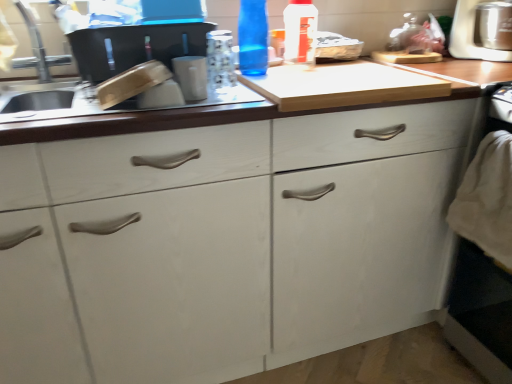
Question: Is blue glass bottle at upper center, arranged as the second bottle when viewed from the right, facing away from white matte cabinet at center?

Choices:
 (A) yes
 (B) no

Answer: (B)

Question: From the image's perspective, is blue glass bottle at upper center, the 1th bottle when ordered from left to right, under white matte cabinet at center?

Choices:
 (A) yes
 (B) no

Answer: (B)

Question: Is blue glass bottle at upper center, arranged as the second bottle when viewed from the right, to the left of white matte cabinet at center from the viewer's perspective?

Choices:
 (A) yes
 (B) no

Answer: (A)

Question: Is blue glass bottle at upper center, arranged as the second bottle when viewed from the right, completely or partially outside of white matte cabinet at center?

Choices:
 (A) no
 (B) yes

Answer: (B)

Question: From a real-world perspective, is blue glass bottle at upper center, the 1th bottle when ordered from left to right, beneath white matte cabinet at center?

Choices:
 (A) yes
 (B) no

Answer: (B)

Question: From the image's perspective, is blue glass bottle at upper center, arranged as the second bottle when viewed from the right, on white matte cabinet at center?

Choices:
 (A) yes
 (B) no

Answer: (A)

Question: Can you confirm if brushed metal faucet at upper left is taller than blue glass bottle at upper center, arranged as the second bottle when viewed from the right?

Choices:
 (A) yes
 (B) no

Answer: (B)

Question: From the image's perspective, is brushed metal faucet at upper left located above blue glass bottle at upper center, the 1th bottle when ordered from left to right?

Choices:
 (A) yes
 (B) no

Answer: (B)

Question: Is there a large distance between brushed metal faucet at upper left and blue glass bottle at upper center, arranged as the second bottle when viewed from the right?

Choices:
 (A) no
 (B) yes

Answer: (A)

Question: Can you confirm if brushed metal faucet at upper left is bigger than blue glass bottle at upper center, arranged as the second bottle when viewed from the right?

Choices:
 (A) yes
 (B) no

Answer: (A)

Question: Is brushed metal faucet at upper left placed right next to blue glass bottle at upper center, the 1th bottle when ordered from left to right?

Choices:
 (A) yes
 (B) no

Answer: (B)

Question: Is blue glass bottle at upper center, the 1th bottle when ordered from left to right, inside brushed metal faucet at upper left?

Choices:
 (A) yes
 (B) no

Answer: (B)

Question: Is transparent plastic bottle at upper center, which is counted as the 2th bottle, starting from the left, directly adjacent to blue glass bottle at upper center, the 1th bottle when ordered from left to right?

Choices:
 (A) no
 (B) yes

Answer: (A)